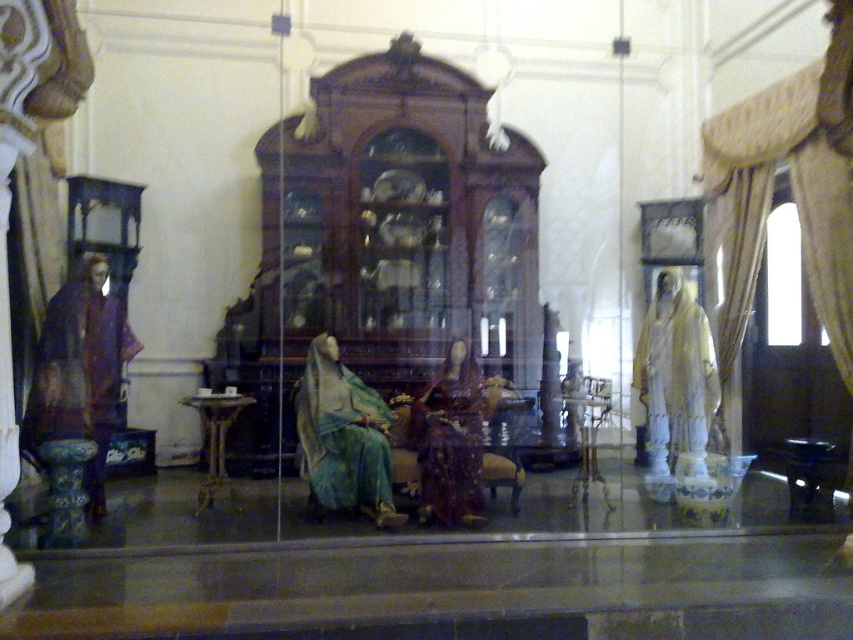
You are an interior designer planning to place a new lamp on the floor in front of the matte green fabric at center. The lamp has a base that requires a 0.3 meter by 0.3 meter clear space. Is there enough space at the specified location?

The position of matte green fabric at center is at point (x=343, y=436), but without information about the surrounding objects or obstacles, it is impossible to determine if there is enough space for the lamp base.

You are a tour guide leading a group through the museum. You need to move from the entrance to the wooden pedestal table at center without touching the matte green fabric at center. Is the space between them wide enough for a person to walk through comfortably?

The distance between the matte green fabric at center and wooden pedestal table at center is 28.16 inches. Since a comfortable walking space for a person is typically around 32 inches or more, the space is slightly narrow but might be manageable for a single person, though it may feel cramped for groups.

You are a visitor in the museum and you see the point at coordinates (343, 436). What is the color of the surface where this point is located?

The point at coordinates (343, 436) is on matte green fabric at center, so the surface is green.